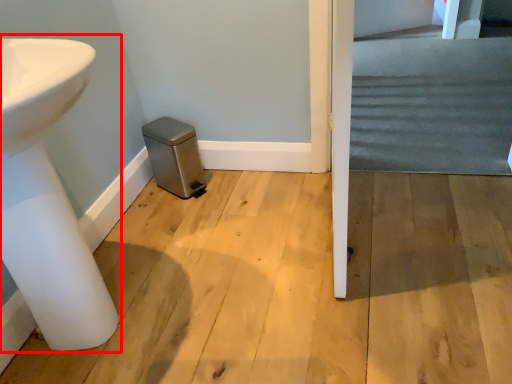
Question: Where is sink (annotated by the red box) located in relation to stairwell in the image?

Choices:
 (A) left
 (B) right

Answer: (A)